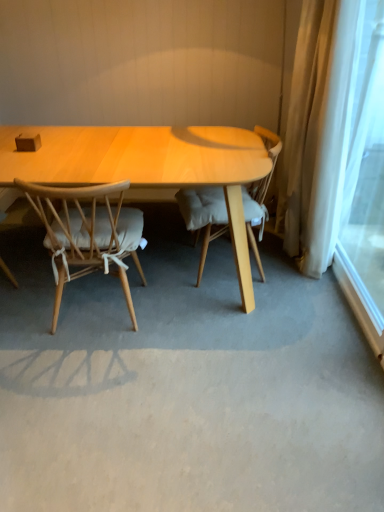
Image resolution: width=384 pixels, height=512 pixels. What are the coordinates of `free spot below light wood chair with cushion at left, which is counted as the 1th chair, starting from the left (from a real-world perspective)` in the screenshot? It's located at (96, 309).